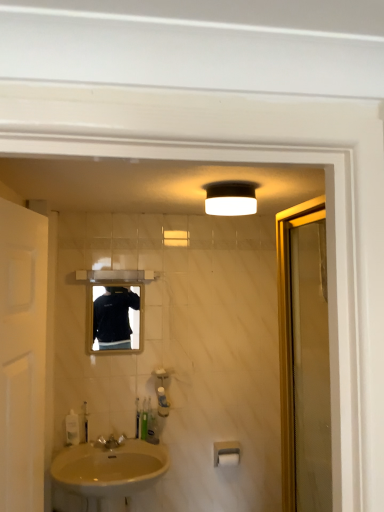
Question: From the image's perspective, does clear plastic bottle at lower left, which ranks as the fifth toiletry in right-to-left order, appear higher than white matte door at left?

Choices:
 (A) yes
 (B) no

Answer: (B)

Question: Can you confirm if clear plastic bottle at lower left, which ranks as the fifth toiletry in right-to-left order, is wider than white matte door at left?

Choices:
 (A) yes
 (B) no

Answer: (B)

Question: Can you confirm if clear plastic bottle at lower left, the 1th toiletry when ordered from left to right, is bigger than white matte door at left?

Choices:
 (A) no
 (B) yes

Answer: (A)

Question: Would you say clear plastic bottle at lower left, the 1th toiletry when ordered from left to right, contains white matte door at left?

Choices:
 (A) no
 (B) yes

Answer: (A)

Question: Considering the relative sizes of clear plastic bottle at lower left, the 1th toiletry when ordered from left to right, and white matte door at left in the image provided, is clear plastic bottle at lower left, the 1th toiletry when ordered from left to right, shorter than white matte door at left?

Choices:
 (A) no
 (B) yes

Answer: (B)

Question: Considering their positions, is beige porcelain sink at lower left located in front of or behind green plastic toothbrush at lower center, the second toiletry viewed from the right?

Choices:
 (A) front
 (B) behind

Answer: (A)

Question: Based on their positions, is beige porcelain sink at lower left located to the left or right of green plastic toothbrush at lower center, the second toiletry viewed from the right?

Choices:
 (A) left
 (B) right

Answer: (A)

Question: Is point (56, 462) closer or farther from the camera than point (155, 428)?

Choices:
 (A) closer
 (B) farther

Answer: (A)

Question: In terms of width, does beige porcelain sink at lower left look wider or thinner when compared to green plastic toothbrush at lower center, which ranks as the fourth toiletry in left-to-right order?

Choices:
 (A) wide
 (B) thin

Answer: (A)

Question: In the image, is white matte door at left positioned in front of or behind beige porcelain sink at lower left?

Choices:
 (A) front
 (B) behind

Answer: (A)

Question: Considering the positions of white matte door at left and beige porcelain sink at lower left in the image, is white matte door at left taller or shorter than beige porcelain sink at lower left?

Choices:
 (A) short
 (B) tall

Answer: (B)

Question: Visually, is white matte door at left positioned to the left or to the right of beige porcelain sink at lower left?

Choices:
 (A) right
 (B) left

Answer: (B)

Question: Considering the positions of white matte door at left and beige porcelain sink at lower left in the image, is white matte door at left wider or thinner than beige porcelain sink at lower left?

Choices:
 (A) thin
 (B) wide

Answer: (A)

Question: In the image, is translucent plastic soap dispenser at lower left on the left side or the right side of green plastic toothbrush at lower center, which ranks as the fourth toiletry in left-to-right order?

Choices:
 (A) left
 (B) right

Answer: (A)

Question: From the image's perspective, is translucent plastic soap dispenser at lower left positioned above or below green plastic toothbrush at lower center, which ranks as the fourth toiletry in left-to-right order?

Choices:
 (A) above
 (B) below

Answer: (A)